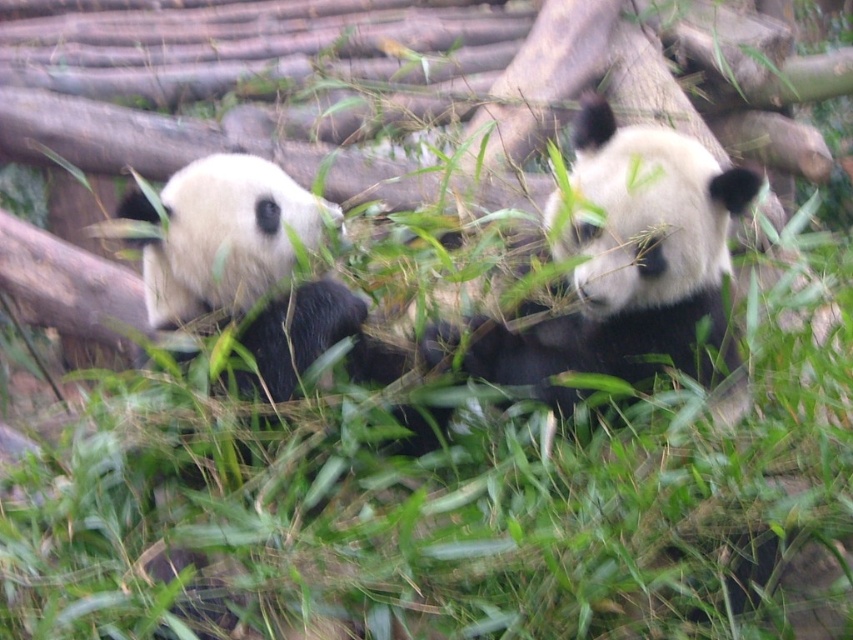
Between black and white fur panda at center and white fur panda at left, which one appears on the left side from the viewer's perspective?

white fur panda at left is more to the left.

Does point (576, 340) lie in front of point (260, 211)?

Yes, point (576, 340) is closer to viewer.

Between point (740, 180) and point (254, 182), which one is positioned behind?

Positioned behind is point (254, 182).

Image resolution: width=853 pixels, height=640 pixels. Identify the location of black and white fur panda at center. (630, 262).